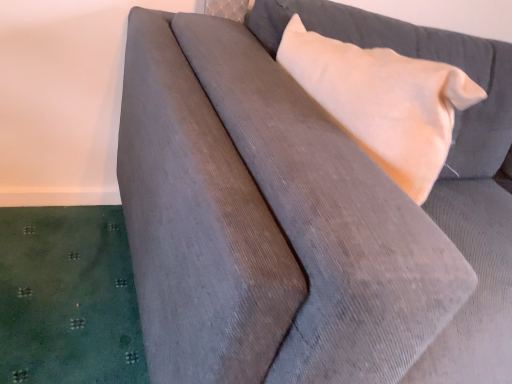
Image resolution: width=512 pixels, height=384 pixels. I want to click on corduroy beige pillow at upper right, so click(383, 101).

In order to face corduroy beige pillow at upper right, should I rotate leftwards or rightwards?

Rotate your view right by about 14.488°.

This screenshot has width=512, height=384. What do you see at coordinates (383, 101) in the screenshot? I see `corduroy beige pillow at upper right` at bounding box center [383, 101].

Find the location of `corduroy beige pillow at upper right`. corduroy beige pillow at upper right is located at coordinates (383, 101).